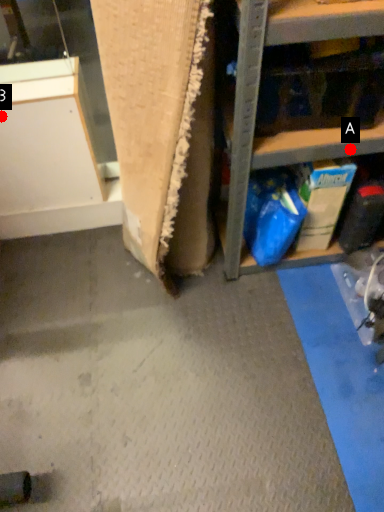
Question: Two points are circled on the image, labeled by A and B beside each circle. Which point appears closest to the camera in this image?

Choices:
 (A) A is closer
 (B) B is closer

Answer: (A)